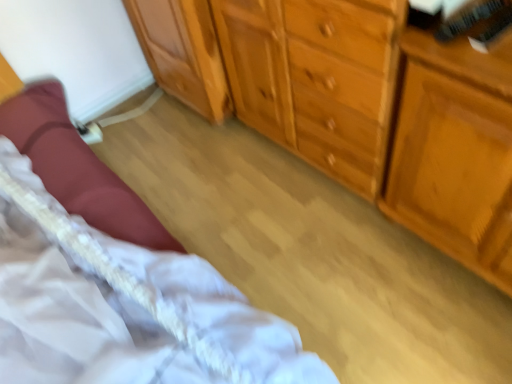
Question: Does light brown wood dresser at center, placed as the first cabinetry when sorted from right to left, come in front of wooden cabinet at center, positioned as the second cabinetry in right-to-left order?

Choices:
 (A) yes
 (B) no

Answer: (A)

Question: From a real-world perspective, is light brown wood dresser at center, placed as the first cabinetry when sorted from right to left, located beneath wooden cabinet at center, positioned as the second cabinetry in right-to-left order?

Choices:
 (A) no
 (B) yes

Answer: (A)

Question: From the image's perspective, is light brown wood dresser at center, placed as the first cabinetry when sorted from right to left, located above wooden cabinet at center, positioned as the second cabinetry in right-to-left order?

Choices:
 (A) no
 (B) yes

Answer: (A)

Question: From a real-world perspective, does light brown wood dresser at center, which is the second cabinetry from left to right, stand above wooden cabinet at center, positioned as the second cabinetry in right-to-left order?

Choices:
 (A) no
 (B) yes

Answer: (B)

Question: Is light brown wood dresser at center, placed as the first cabinetry when sorted from right to left, bigger than wooden cabinet at center, positioned as the second cabinetry in right-to-left order?

Choices:
 (A) no
 (B) yes

Answer: (B)

Question: Can you confirm if light brown wood dresser at center, placed as the first cabinetry when sorted from right to left, is thinner than wooden cabinet at center, the 1th cabinetry in the left-to-right sequence?

Choices:
 (A) no
 (B) yes

Answer: (A)

Question: Can you confirm if wooden chest of drawers at center is positioned to the left of wooden dresser at right?

Choices:
 (A) yes
 (B) no

Answer: (A)

Question: Is wooden chest of drawers at center positioned before wooden dresser at right?

Choices:
 (A) no
 (B) yes

Answer: (B)

Question: Is wooden chest of drawers at center outside of wooden dresser at right?

Choices:
 (A) no
 (B) yes

Answer: (B)

Question: Can you confirm if wooden chest of drawers at center is wider than wooden dresser at right?

Choices:
 (A) yes
 (B) no

Answer: (A)

Question: Can you confirm if wooden chest of drawers at center is smaller than wooden dresser at right?

Choices:
 (A) no
 (B) yes

Answer: (A)

Question: From a real-world perspective, is wooden chest of drawers at center beneath wooden dresser at right?

Choices:
 (A) no
 (B) yes

Answer: (A)

Question: From the image's perspective, is wooden dresser at right located beneath wooden cabinet at center, positioned as the second cabinetry in right-to-left order?

Choices:
 (A) yes
 (B) no

Answer: (A)